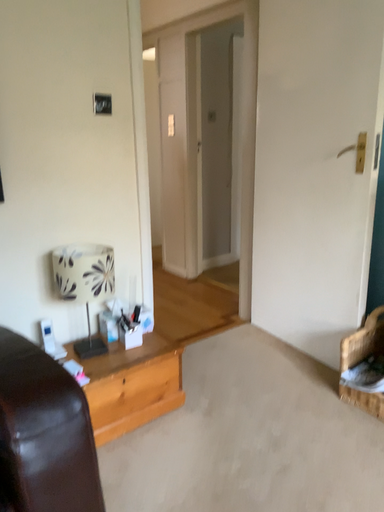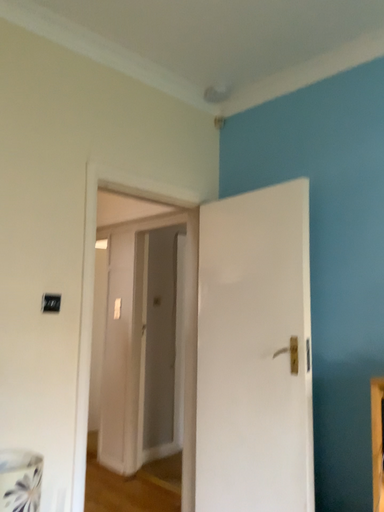
Question: How did the camera likely rotate when shooting the video?

Choices:
 (A) rotated upward
 (B) rotated downward

Answer: (A)